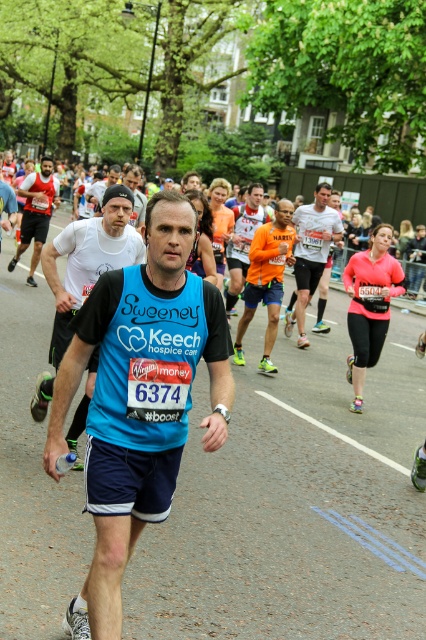
Question: Does blue fabric vest at center have a lesser width compared to matte black cap at upper center?

Choices:
 (A) yes
 (B) no

Answer: (B)

Question: Can you confirm if blue fabric vest at center is positioned to the right of blue fabric shirt at center?

Choices:
 (A) no
 (B) yes

Answer: (B)

Question: Which of these objects is positioned closest to the pink matte leggings at center?

Choices:
 (A) matte red tank top at left
 (B) blue fabric vest at center
 (C) blue fabric shirt at center
 (D) orange reflective vest at center

Answer: (D)

Question: Which point is closer to the camera?

Choices:
 (A) matte black cap at upper center
 (B) matte red tank top at left

Answer: (A)

Question: Does pink matte leggings at center appear under matte black cap at upper center?

Choices:
 (A) no
 (B) yes

Answer: (B)

Question: Estimate the real-world distances between objects in this image. Which object is farther from the matte red tank top at left?

Choices:
 (A) blue fabric vest at center
 (B) matte black cap at upper center
 (C) blue fabric shirt at center

Answer: (A)